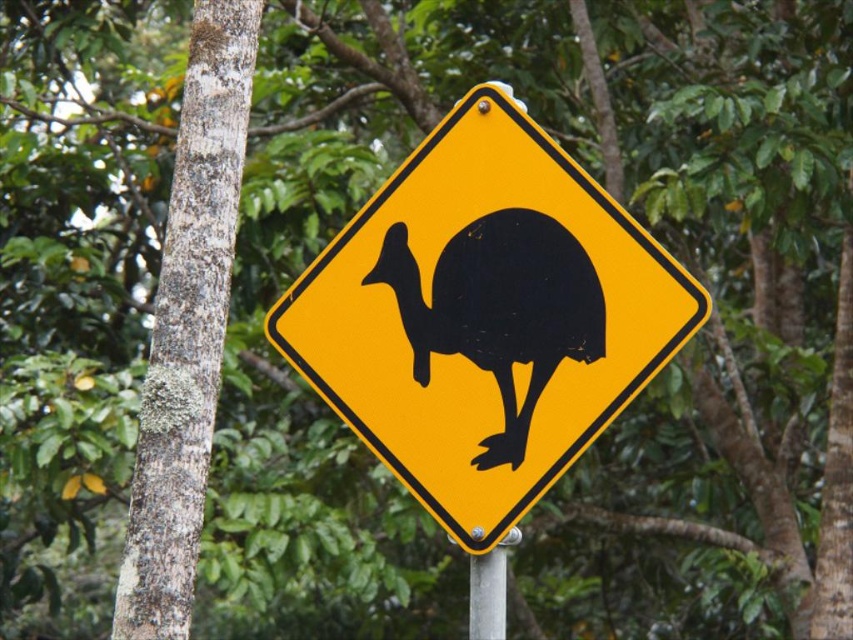
Question: Can you confirm if black glossy bird at center is positioned to the left of silver metallic pole at center?

Choices:
 (A) no
 (B) yes

Answer: (B)

Question: Which point is farther to the camera?

Choices:
 (A) black glossy bird at center
 (B) yellow plastic sign at center
 (C) silver metallic pole at center

Answer: (C)

Question: In this image, where is yellow plastic sign at center located relative to black glossy bird at center?

Choices:
 (A) left
 (B) right

Answer: (A)

Question: Does yellow plastic sign at center come in front of black glossy bird at center?

Choices:
 (A) no
 (B) yes

Answer: (B)

Question: Which object is the closest to the yellow plastic sign at center?

Choices:
 (A) black glossy bird at center
 (B) silver metallic pole at center

Answer: (A)

Question: Which of the following is the closest to the observer?

Choices:
 (A) (469, 352)
 (B) (438, 259)

Answer: (A)